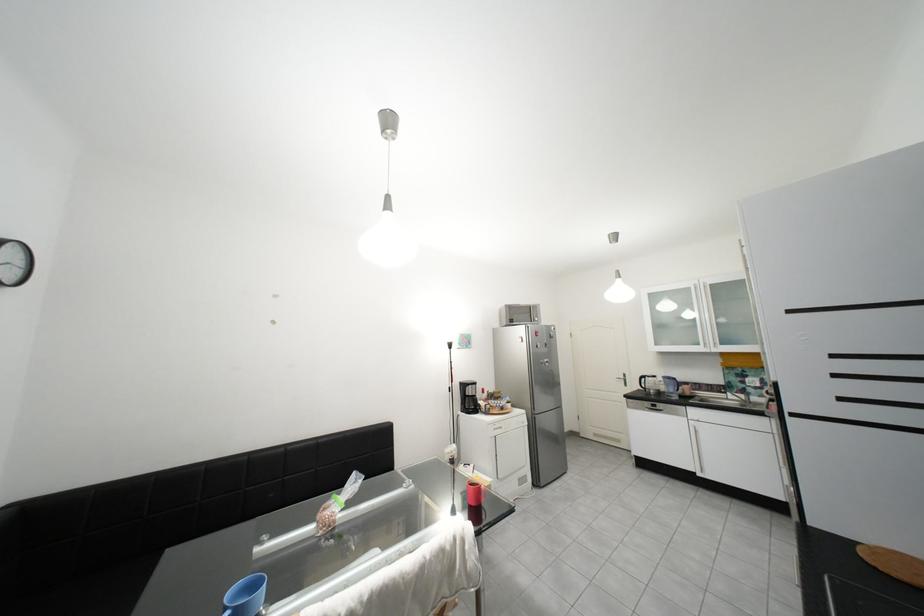
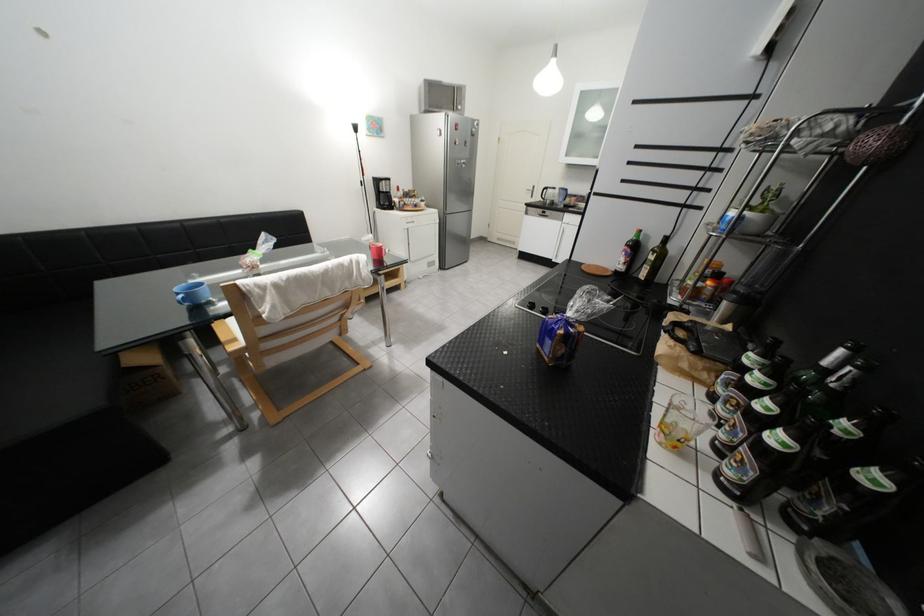
In the second image, find the point that corresponds to point (479, 400) in the first image.

(393, 196)